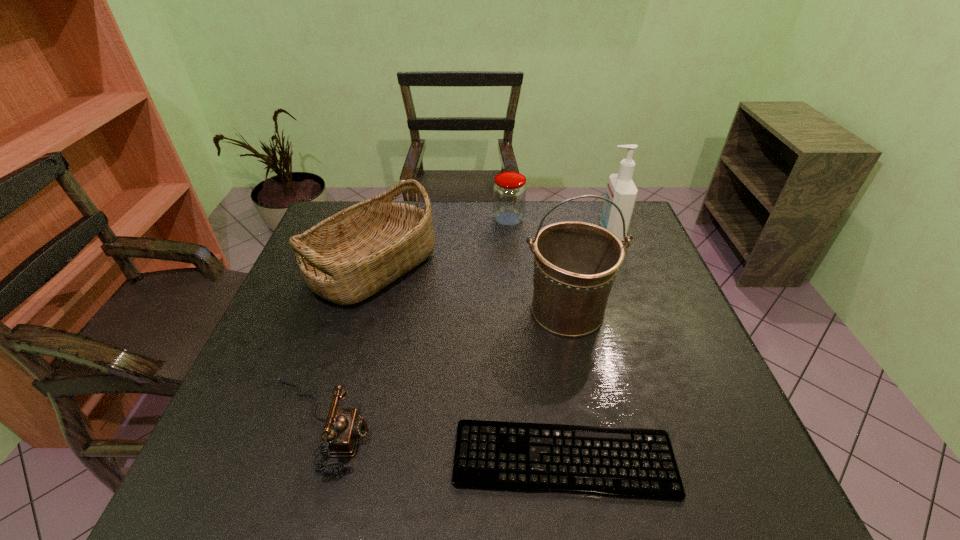
This screenshot has width=960, height=540. I want to click on vacant space at the left edge of the desktop, so click(300, 286).

Image resolution: width=960 pixels, height=540 pixels. Identify the location of free space at the right edge of the desktop. (671, 383).

Where is `blank area at the near left corner`? The image size is (960, 540). blank area at the near left corner is located at coordinates pos(256,475).

I want to click on vacant region at the near right corner of the desktop, so click(739, 470).

Locate an element on the screen. Image resolution: width=960 pixels, height=540 pixels. vacant space that's between the bucket and the third tallest object is located at coordinates (470, 288).

Locate an element on the screen. This screenshot has height=540, width=960. empty space that is in between the second shortest object and the jar is located at coordinates pos(412,323).

Locate an element on the screen. This screenshot has height=540, width=960. empty location between the jar and the second shortest object is located at coordinates (412, 323).

Locate an element on the screen. empty space that is in between the bucket and the fifth tallest object is located at coordinates (442, 369).

This screenshot has height=540, width=960. Identify the location of free space between the second shortest object and the shortest object. (440, 443).

Find the location of a particular element. Image resolution: width=960 pixels, height=540 pixels. object identified as the second closest to the shortest object is located at coordinates (575, 263).